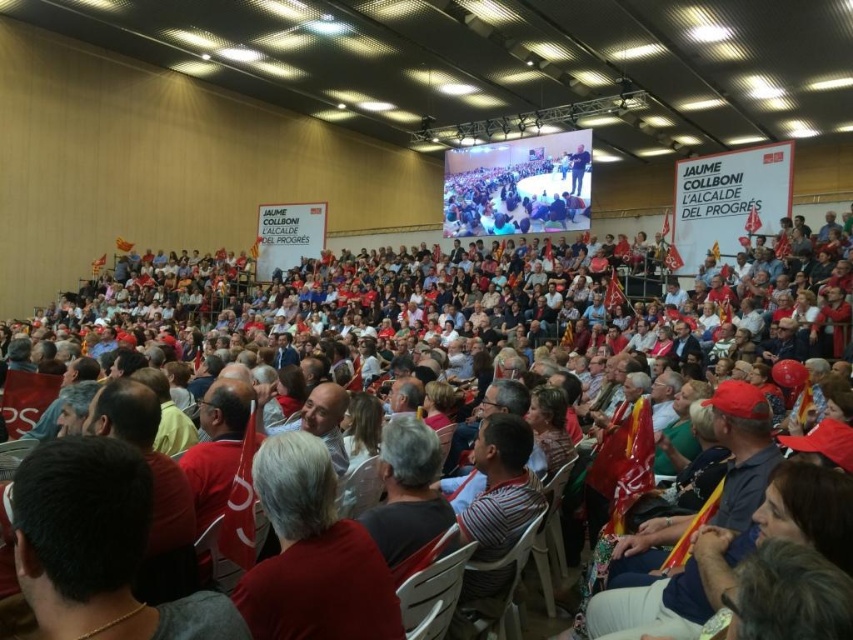
Question: Is red fabric at center positioned before red fabric hat at center?

Choices:
 (A) yes
 (B) no

Answer: (A)

Question: Is red shirt at lower left bigger than red fabric at center?

Choices:
 (A) yes
 (B) no

Answer: (B)

Question: Which object appears farthest from the camera in this image?

Choices:
 (A) red fabric hat at center
 (B) red shirt at lower left

Answer: (A)

Question: Which is farther from the red fabric hat at center?

Choices:
 (A) red shirt at lower left
 (B) red fabric at center

Answer: (A)

Question: Which of the following is the farthest from the observer?

Choices:
 (A) (48, 632)
 (B) (299, 572)
 (C) (425, 448)

Answer: (C)

Question: Is red shirt at lower left to the right of red fabric hat at center from the viewer's perspective?

Choices:
 (A) yes
 (B) no

Answer: (B)